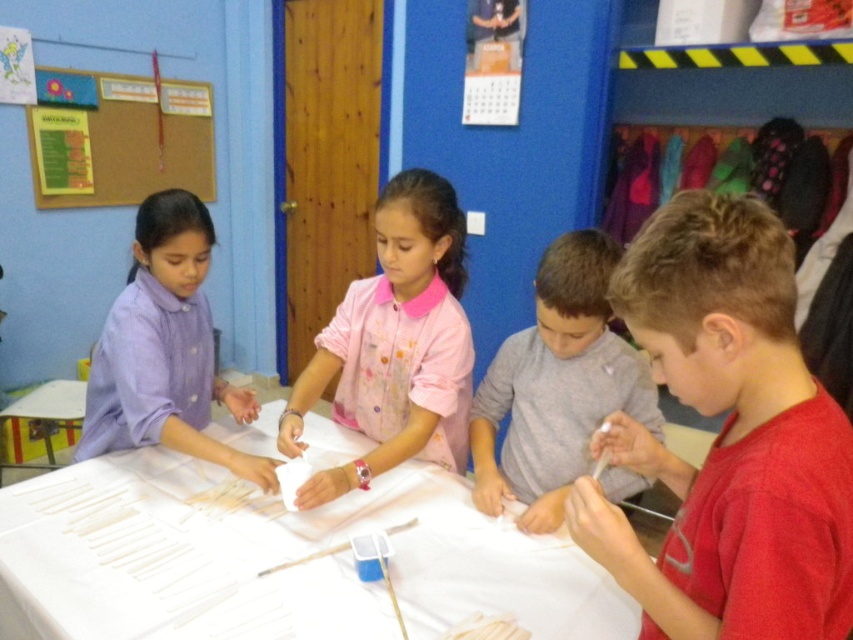
Looking at this image, you are standing in front of the table where the children are working. There is a gray cotton shirt at center. If you want to reach the shirt without moving your feet, can you do it?

The gray cotton shirt at center is 1.29 meters from viewer. Since the average human arm length is about 0.7 meters, you cannot reach it without moving your feet.